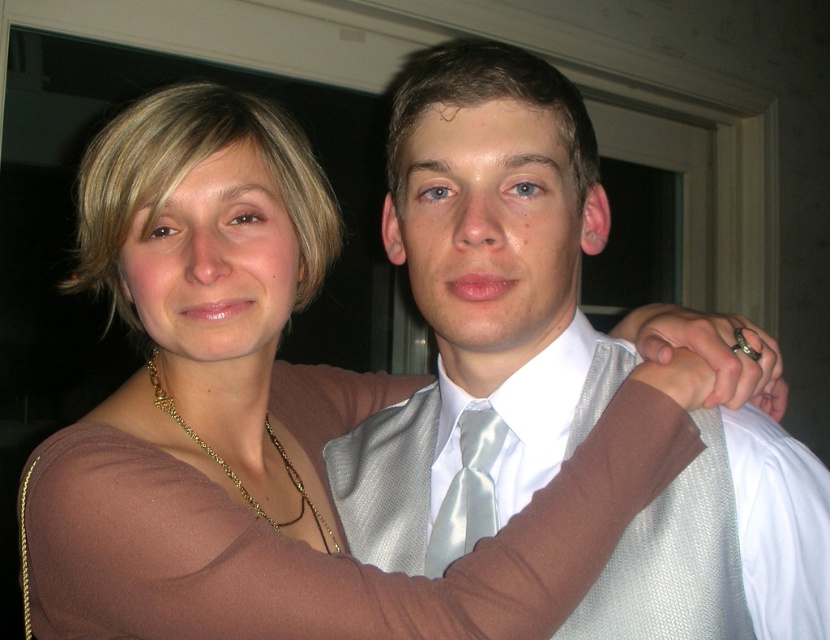
Looking at this image, can you confirm if satin white vest at center is thinner than gold chain necklace at center?

No, satin white vest at center is not thinner than gold chain necklace at center.

Can you confirm if satin white vest at center is positioned to the left of gold chain necklace at center?

Incorrect, satin white vest at center is not on the left side of gold chain necklace at center.

You are a GUI agent. You are given a task and a screenshot of the screen. Output one action in this format:
    pyautogui.click(x=<x>, y=<y>)
    Task: Click on the satin white vest at center
    This screenshot has height=640, width=830.
    Given the screenshot: What is the action you would take?
    pyautogui.click(x=481, y=307)

Does satin white vest at center have a smaller size compared to satin light blue tie at center?

Actually, satin white vest at center might be larger than satin light blue tie at center.

Describe the element at coordinates (481, 307) in the screenshot. I see `satin white vest at center` at that location.

Locate an element on the screen. satin white vest at center is located at coordinates (481, 307).

Which is in front, point (491, 451) or point (252, 508)?

Positioned in front is point (491, 451).

Consider the image. Is satin light blue tie at center bigger than gold chain necklace at center?

No, satin light blue tie at center is not bigger than gold chain necklace at center.

Who is more distant from viewer, (438, 552) or (299, 508)?

The point (299, 508) is behind.

At what (x,y) coordinates should I click in order to perform the action: click on satin light blue tie at center. Please return your answer as a coordinate pair (x, y). Looking at the image, I should click on (467, 492).